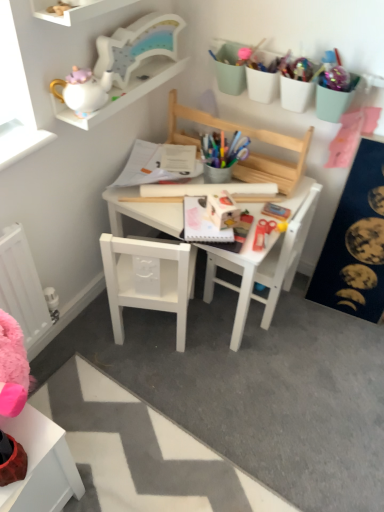
Image resolution: width=384 pixels, height=512 pixels. In order to click on free space in front of white matte chair at lower left, the 1th chair from the left in this screenshot , I will do `click(146, 380)`.